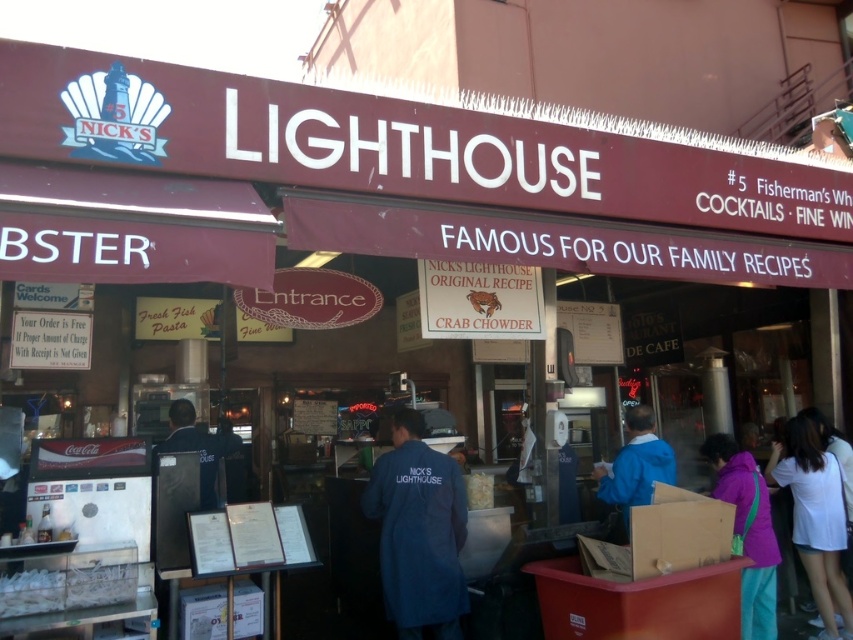
Question: Is blue fabric jacket at center positioned in front of dark blue uniform at center?

Choices:
 (A) no
 (B) yes

Answer: (B)

Question: In this image, where is white cotton shirt at lower right located relative to dark blue uniform at center?

Choices:
 (A) left
 (B) right

Answer: (B)

Question: Can you confirm if blue fabric jacket at center is positioned to the left of dark blue uniform at center?

Choices:
 (A) no
 (B) yes

Answer: (A)

Question: Which object appears farthest from the camera in this image?

Choices:
 (A) purple fleece jacket at lower right
 (B) dark blue uniform at center
 (C) blue fabric jacket at center
 (D) blue fabric coat at center

Answer: (B)

Question: Estimate the real-world distances between objects in this image. Which object is closer to the blue fabric jacket at center?

Choices:
 (A) white cotton shirt at lower right
 (B) dark blue uniform at center
 (C) purple fleece jacket at lower right

Answer: (C)

Question: Which of the following is the closest to the observer?

Choices:
 (A) (809, 532)
 (B) (200, 433)
 (C) (772, 609)
 (D) (627, 449)

Answer: (C)